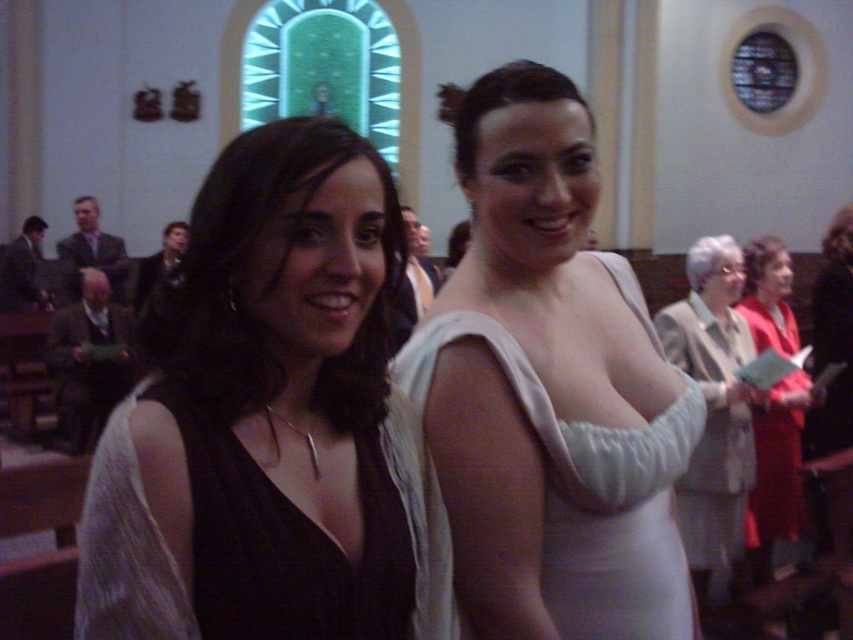
Is matte black dress at center thinner than white satin dress at center?

Yes, matte black dress at center is thinner than white satin dress at center.

Consider the image. Between matte black dress at center and white satin dress at center, which one has less height?

matte black dress at center is shorter.

At what (x,y) coordinates should I click in order to perform the action: click on matte black dress at center. Please return your answer as a coordinate pair (x, y). The image size is (853, 640). Looking at the image, I should click on (270, 420).

Where is `matte black dress at center`? The height and width of the screenshot is (640, 853). matte black dress at center is located at coordinates (270, 420).

Based on the photo, does black satin dress at center appear on the left side of light beige fabric dress at center?

Correct, you'll find black satin dress at center to the left of light beige fabric dress at center.

Who is taller, black satin dress at center or light beige fabric dress at center?

With more height is light beige fabric dress at center.

Is point (115, 593) behind point (671, 339)?

No, it is not.

You are a GUI agent. You are given a task and a screenshot of the screen. Output one action in this format:
    pyautogui.click(x=<x>, y=<y>)
    Task: Click on the black satin dress at center
    The height and width of the screenshot is (640, 853).
    Given the screenshot: What is the action you would take?
    pyautogui.click(x=125, y=548)

Which of these two, white satin dress at center or black satin dress at center, stands shorter?

black satin dress at center is shorter.

Which is more to the left, white satin dress at center or black satin dress at center?

black satin dress at center is more to the left.

What are the coordinates of `white satin dress at center` in the screenshot? It's located at (550, 388).